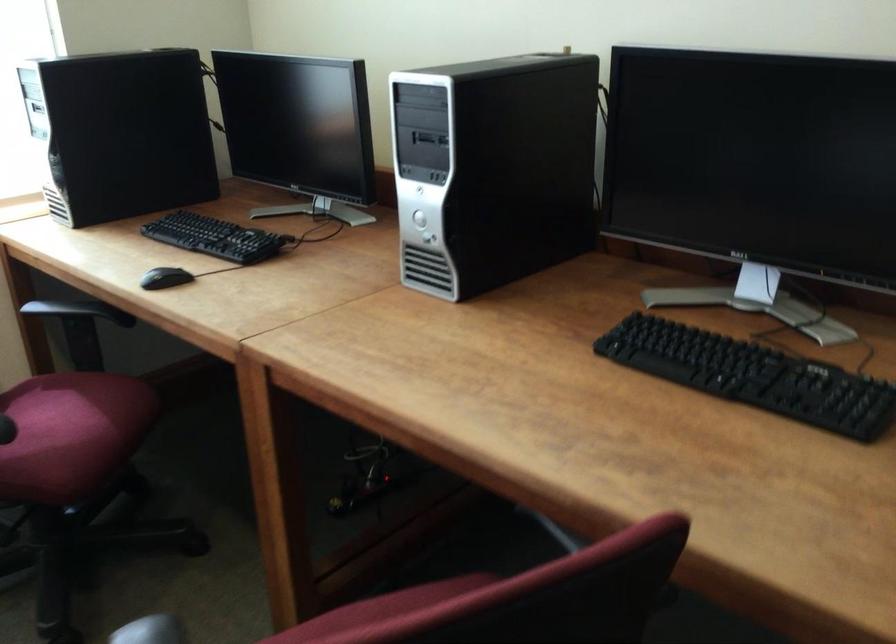
Where would you grasp the black chair armrest? Please return your answer as a coordinate pair (x, y).

(74, 310)